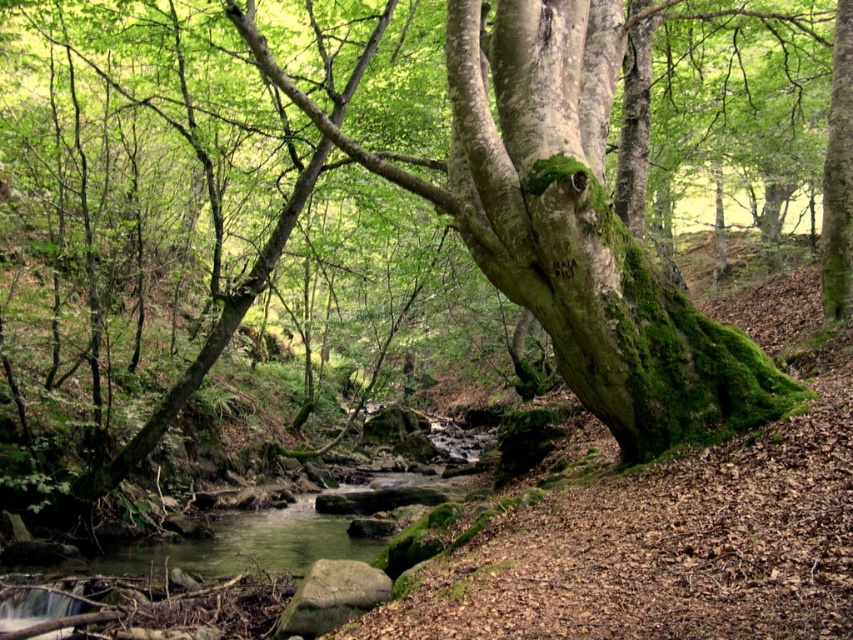
Question: Can you confirm if green mossy tree trunk at center is positioned below green mossy tree trunk at upper right?

Choices:
 (A) no
 (B) yes

Answer: (B)

Question: Observing the image, what is the correct spatial positioning of green mossy tree trunk at center in reference to green mossy tree trunk at upper right?

Choices:
 (A) left
 (B) right

Answer: (A)

Question: Which point is farther to the camera?

Choices:
 (A) green mossy tree trunk at center
 (B) green mossy tree trunk at upper right

Answer: (B)

Question: Is green mossy tree trunk at center smaller than green mossy tree trunk at upper right?

Choices:
 (A) no
 (B) yes

Answer: (A)

Question: Which point appears farthest from the camera in this image?

Choices:
 (A) (578, 385)
 (B) (837, 51)

Answer: (B)